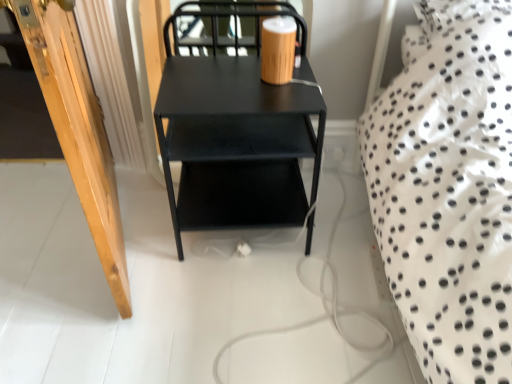
This screenshot has width=512, height=384. I want to click on vacant area that lies to the right of matte black table at center, so click(344, 228).